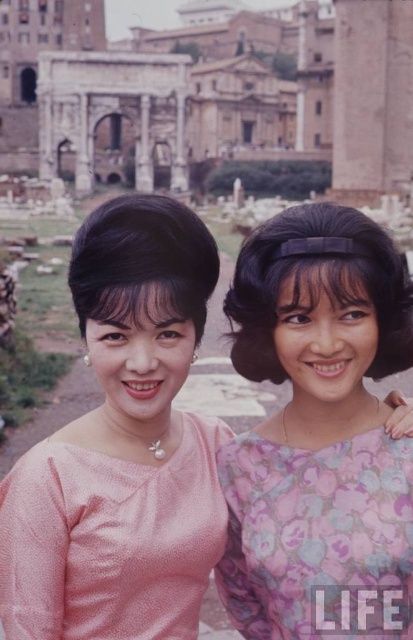
Describe the element at coordinates (320, 433) in the screenshot. This screenshot has width=413, height=640. I see `pink floral dress at center` at that location.

Does pink floral dress at center lie behind pink satin dress at center?

That is True.

Where is `pink floral dress at center`? Image resolution: width=413 pixels, height=640 pixels. pink floral dress at center is located at coordinates (320, 433).

Can you confirm if pink floral dress at center is thinner than floral-patterned fabric dress at center?

In fact, pink floral dress at center might be wider than floral-patterned fabric dress at center.

This screenshot has height=640, width=413. What do you see at coordinates (320, 433) in the screenshot?
I see `pink floral dress at center` at bounding box center [320, 433].

Find the location of a particular element. pink floral dress at center is located at coordinates (320, 433).

From the picture: Is pink textured dress at center shorter than floral-patterned fabric dress at center?

Yes, pink textured dress at center is shorter than floral-patterned fabric dress at center.

Where is `pink textured dress at center`? This screenshot has width=413, height=640. pink textured dress at center is located at coordinates (111, 540).